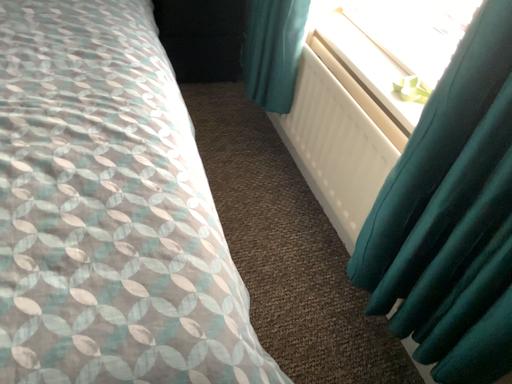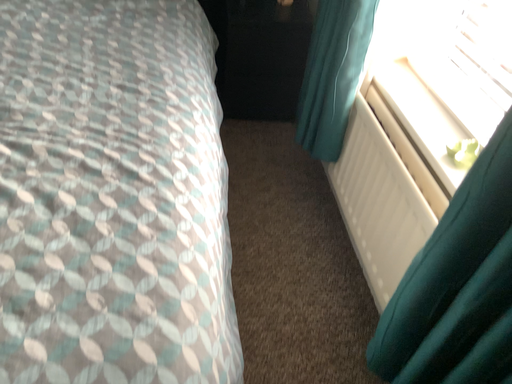
Question: How did the camera likely rotate when shooting the video?

Choices:
 (A) rotated left
 (B) rotated right

Answer: (A)